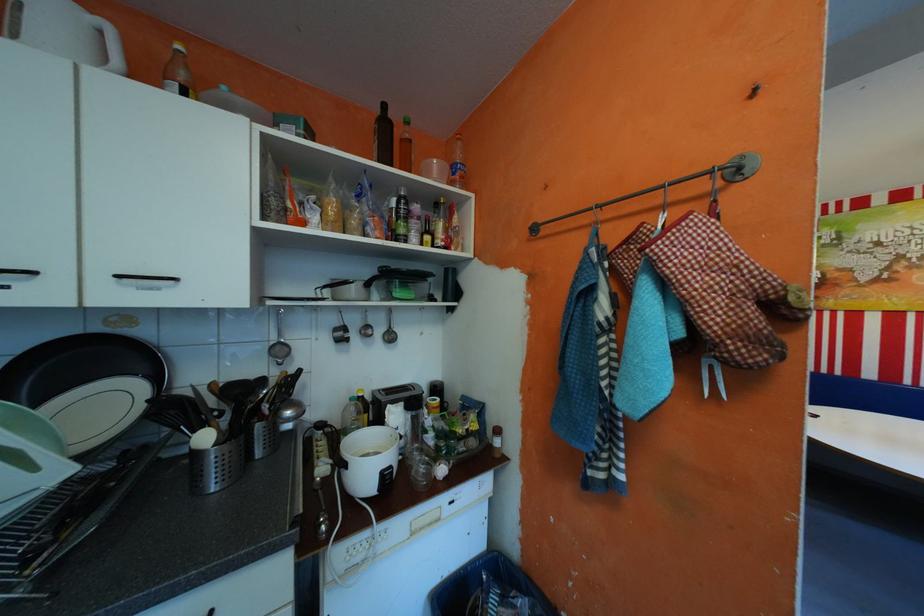
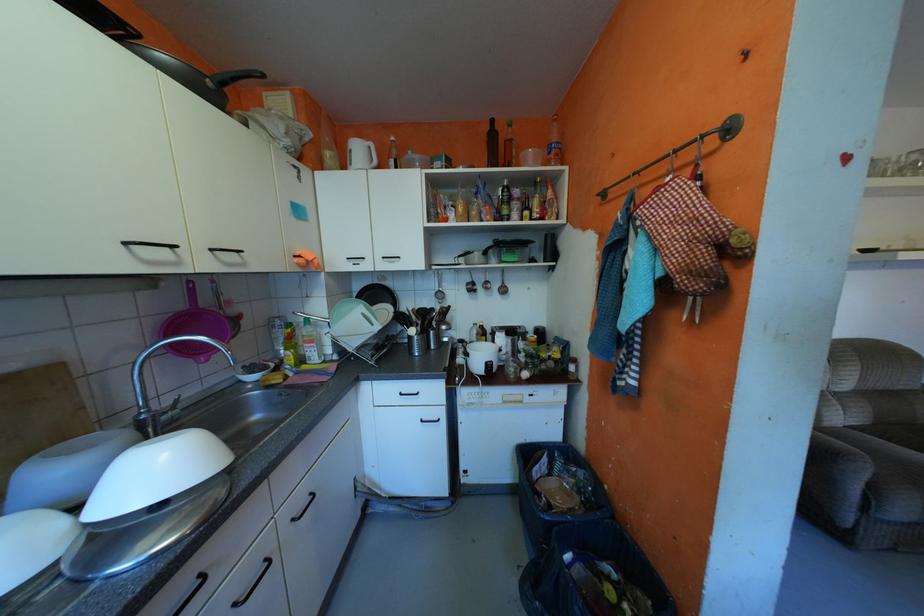
Question: The first image is from the beginning of the video and the second image is from the end. How did the camera likely rotate when shooting the video?

Choices:
 (A) Left
 (B) Right
 (C) Up
 (D) Down

Answer: (A)